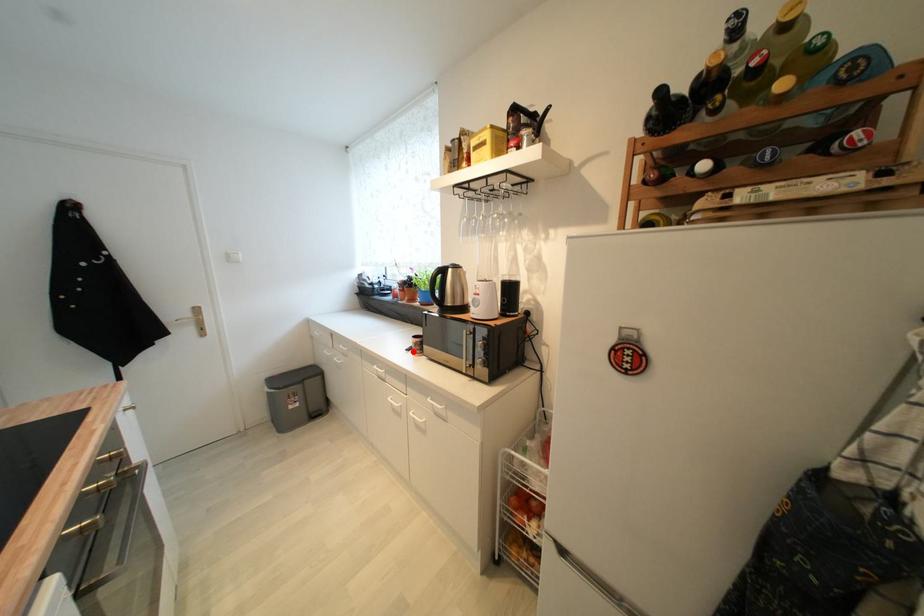
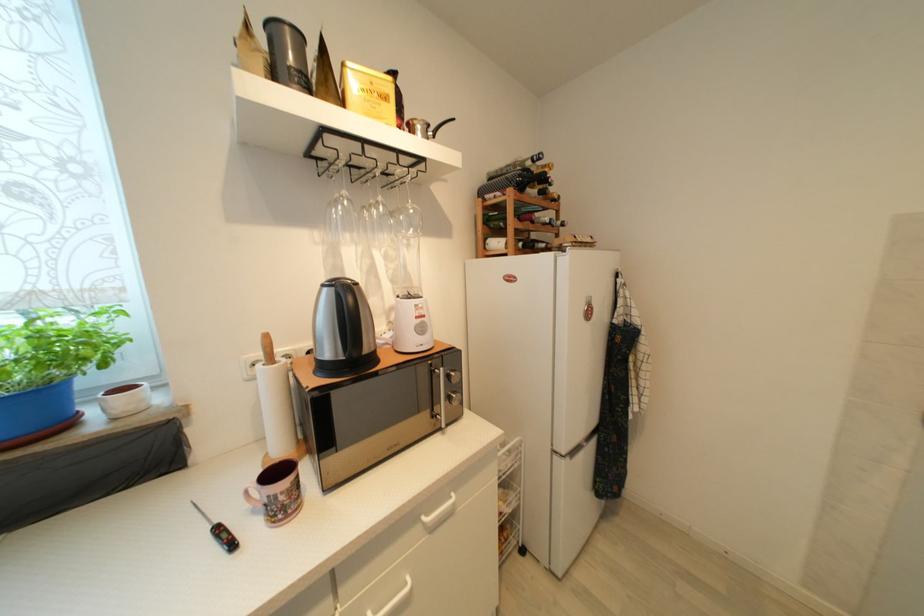
The point at the highlighted location is marked in the first image. Where is the corresponding point in the second image?

(237, 546)